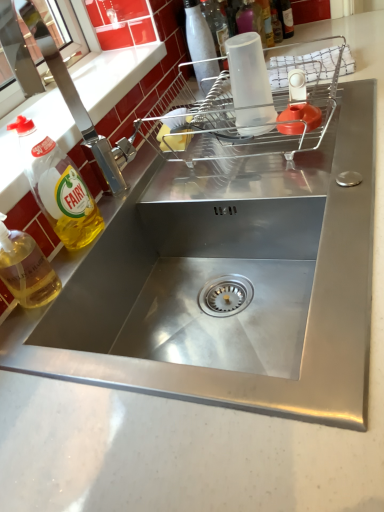
Question: Can you confirm if white glossy bottle at upper center, the 3th bottle in the back-to-front sequence, is bigger than yellow translucent liquid at left, which appears as the 1th bottle when viewed from the front?

Choices:
 (A) no
 (B) yes

Answer: (A)

Question: From a real-world perspective, is white glossy bottle at upper center, the 3th bottle in the back-to-front sequence, physically above yellow translucent liquid at left, which appears as the 1th bottle when viewed from the front?

Choices:
 (A) no
 (B) yes

Answer: (B)

Question: Is white glossy bottle at upper center, which appears as the third bottle when viewed from the front, surrounding yellow translucent liquid at left, placed as the 5th bottle when sorted from back to front?

Choices:
 (A) yes
 (B) no

Answer: (B)

Question: Can you confirm if white glossy bottle at upper center, the third bottle positioned from the left, is taller than yellow translucent liquid at left, placed as the 5th bottle when sorted from back to front?

Choices:
 (A) yes
 (B) no

Answer: (A)

Question: Is white glossy bottle at upper center, the 3th bottle in the back-to-front sequence, to the left of yellow translucent liquid at left, which is the 1th bottle in left-to-right order, from the viewer's perspective?

Choices:
 (A) no
 (B) yes

Answer: (A)

Question: Is white glossy bottle at upper center, the 3th bottle in the back-to-front sequence, inside the boundaries of translucent plastic bottle at upper right, arranged as the fifth bottle when viewed from the left, or outside?

Choices:
 (A) outside
 (B) inside

Answer: (A)

Question: Would you say white glossy bottle at upper center, the third bottle positioned from the top, is to the left or to the right of translucent plastic bottle at upper right, which is the 5th bottle in front-to-back order, in the picture?

Choices:
 (A) left
 (B) right

Answer: (A)

Question: From a real-world perspective, is white glossy bottle at upper center, placed as the 3th bottle when sorted from bottom to top, above or below translucent plastic bottle at upper right, arranged as the fifth bottle when viewed from the left?

Choices:
 (A) below
 (B) above

Answer: (B)

Question: In terms of height, does white glossy bottle at upper center, the third bottle positioned from the left, look taller or shorter compared to translucent plastic bottle at upper right, which is the 5th bottle in front-to-back order?

Choices:
 (A) tall
 (B) short

Answer: (A)

Question: Relative to transparent plastic cup at upper center, placed as the second bottle when sorted from back to front, is clear plastic dish rack at upper center in front or behind?

Choices:
 (A) front
 (B) behind

Answer: (A)

Question: Is clear plastic dish rack at upper center taller or shorter than transparent plastic cup at upper center, the 4th bottle viewed from the left?

Choices:
 (A) tall
 (B) short

Answer: (B)

Question: Choose the correct answer: Is clear plastic dish rack at upper center inside transparent plastic cup at upper center, the 2th bottle from the right, or outside it?

Choices:
 (A) inside
 (B) outside

Answer: (B)

Question: Considering the relative positions of clear plastic dish rack at upper center and transparent plastic cup at upper center, marked as the 2th bottle in a top-to-bottom arrangement, in the image provided, is clear plastic dish rack at upper center to the left or to the right of transparent plastic cup at upper center, marked as the 2th bottle in a top-to-bottom arrangement,?

Choices:
 (A) left
 (B) right

Answer: (A)

Question: From the image's perspective, is yellow translucent liquid at left, positioned as the fourth bottle in right-to-left order, positioned above or below clear plastic dish rack at upper center?

Choices:
 (A) below
 (B) above

Answer: (A)

Question: Considering the relative positions of yellow translucent liquid at left, the fourth bottle viewed from the back, and clear plastic dish rack at upper center in the image provided, is yellow translucent liquid at left, the fourth bottle viewed from the back, to the left or to the right of clear plastic dish rack at upper center?

Choices:
 (A) left
 (B) right

Answer: (A)